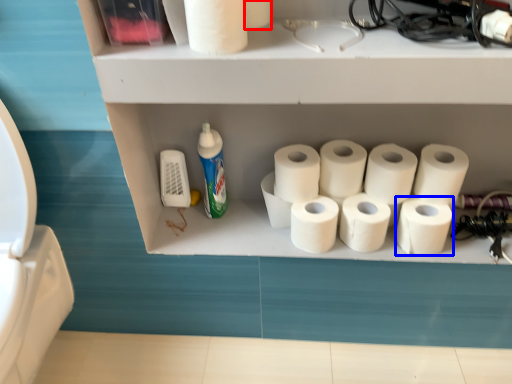
Question: Which object appears farthest to the camera in this image, toilet paper (highlighted by a red box) or toilet paper (highlighted by a blue box)?

Choices:
 (A) toilet paper
 (B) toilet paper

Answer: (B)